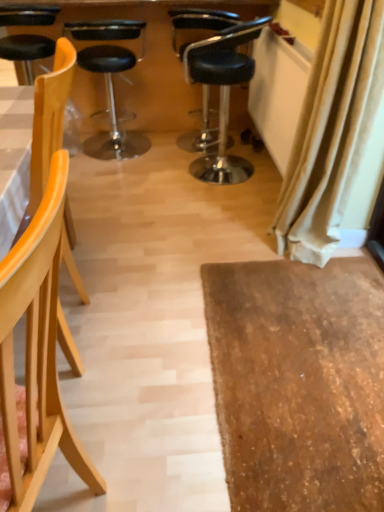
Question: Is light wood chair at left, the first chair in the front-to-back sequence, positioned with its back to black leather chair at center, arranged as the 5th chair when viewed from the front?

Choices:
 (A) yes
 (B) no

Answer: (B)

Question: Does light wood chair at left, the first chair in the front-to-back sequence, have a greater height compared to black leather chair at center, which appears as the first chair when viewed from the back?

Choices:
 (A) no
 (B) yes

Answer: (B)

Question: From the image's perspective, does light wood chair at left, the 5th chair in the back-to-front sequence, appear higher than black leather chair at center, arranged as the 5th chair when viewed from the front?

Choices:
 (A) yes
 (B) no

Answer: (B)

Question: Considering the relative sizes of light wood chair at left, the 5th chair in the back-to-front sequence, and black leather chair at center, arranged as the 5th chair when viewed from the front, in the image provided, is light wood chair at left, the 5th chair in the back-to-front sequence, bigger than black leather chair at center, arranged as the 5th chair when viewed from the front,?

Choices:
 (A) no
 (B) yes

Answer: (B)

Question: Is light wood chair at left, the first chair in the front-to-back sequence, shorter than black leather chair at center, arranged as the 5th chair when viewed from the front?

Choices:
 (A) no
 (B) yes

Answer: (A)

Question: Does light wood chair at left, the 5th chair in the back-to-front sequence, appear on the left side of black leather chair at center, arranged as the 5th chair when viewed from the front?

Choices:
 (A) yes
 (B) no

Answer: (A)

Question: From the image's perspective, is black leather chair at center, arranged as the 5th chair when viewed from the front, located above light wood chair at left, the first chair in the front-to-back sequence?

Choices:
 (A) no
 (B) yes

Answer: (B)

Question: Can you confirm if black leather chair at center, arranged as the 5th chair when viewed from the front, is wider than light wood chair at left, the first chair in the front-to-back sequence?

Choices:
 (A) no
 (B) yes

Answer: (A)

Question: From the image's perspective, is black leather chair at center, arranged as the 5th chair when viewed from the front, under light wood chair at left, the first chair in the front-to-back sequence?

Choices:
 (A) no
 (B) yes

Answer: (A)

Question: Is black leather chair at center, arranged as the 5th chair when viewed from the front, outside of light wood chair at left, the 5th chair in the back-to-front sequence?

Choices:
 (A) no
 (B) yes

Answer: (B)

Question: Is black leather chair at center, which appears as the first chair when viewed from the back, positioned before light wood chair at left, the 5th chair in the back-to-front sequence?

Choices:
 (A) yes
 (B) no

Answer: (B)

Question: Can you confirm if black leather chair at center, arranged as the 5th chair when viewed from the front, is positioned to the right of light wood chair at left, the 5th chair in the back-to-front sequence?

Choices:
 (A) yes
 (B) no

Answer: (A)

Question: Are black leather stool at center, the second chair when ordered from back to front, and light wood chair at left, the 4th chair viewed from the back, making contact?

Choices:
 (A) no
 (B) yes

Answer: (A)